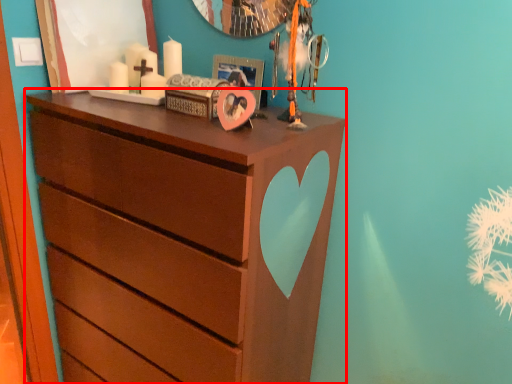
Question: In this image, where is chest of drawers (annotated by the red box) located relative to picture frame?

Choices:
 (A) right
 (B) left

Answer: (B)